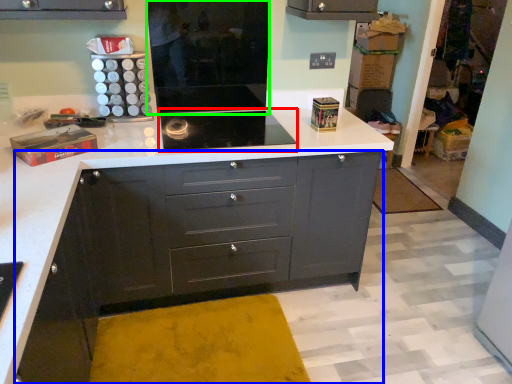
Question: Considering the real-world distances, which object is farthest from home appliance (highlighted by a red box)? chest of drawers (highlighted by a blue box) or appliance (highlighted by a green box)?

Choices:
 (A) chest of drawers
 (B) appliance

Answer: (A)